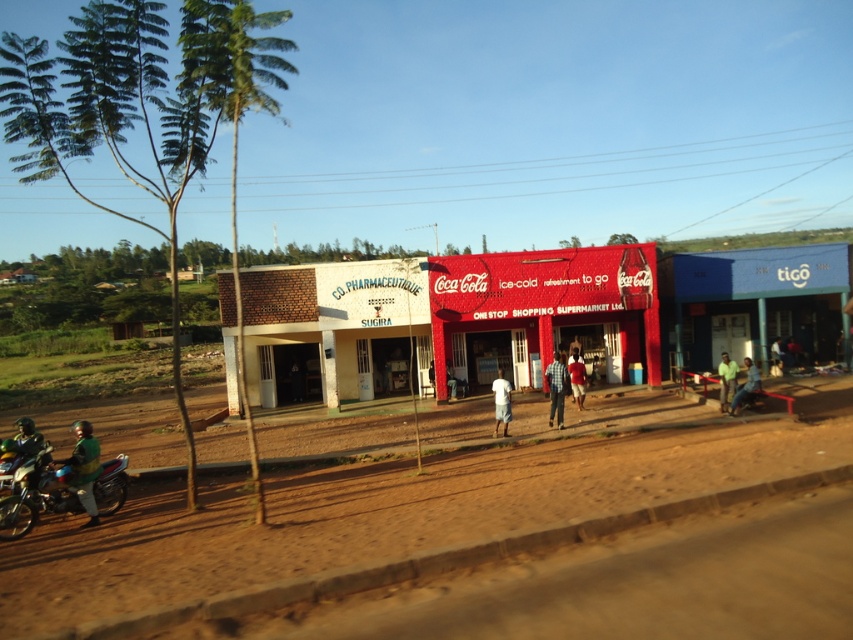
You are a photographer trying to capture a photo of the checkered shirt at center and the green fabric shirt at right. Which shirt should you zoom in on to ensure both shirts are in focus without adjusting your camera settings?

The checkered shirt at center has a lesser width compared to green fabric shirt at right, so you should zoom in on the checkered shirt at center to ensure both shirts are in focus since it is smaller and closer to the camera.

You are standing on the dirt road and see the brown sandy dirt field at lower center and the green fabric helmet at lower left. Which object is located to the right of the other?

The brown sandy dirt field at lower center is located to the right of the green fabric helmet at lower left.